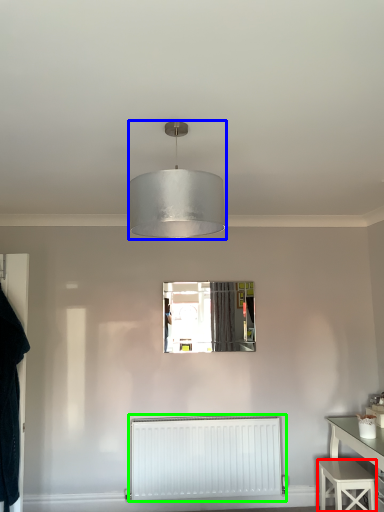
Question: Considering the real-world distances, which object is farthest from stool (highlighted by a red box)? lamp (highlighted by a blue box) or radiator (highlighted by a green box)?

Choices:
 (A) lamp
 (B) radiator

Answer: (A)